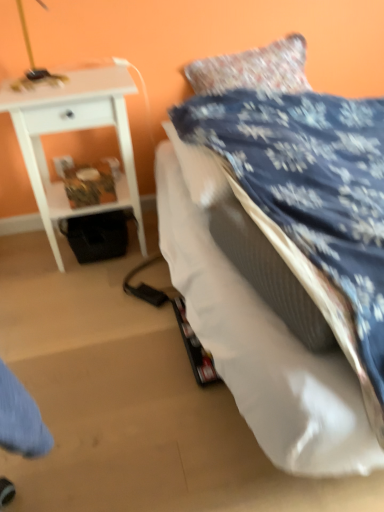
This screenshot has width=384, height=512. I want to click on vacant point to the left of white glossy nightstand at upper left, so click(24, 259).